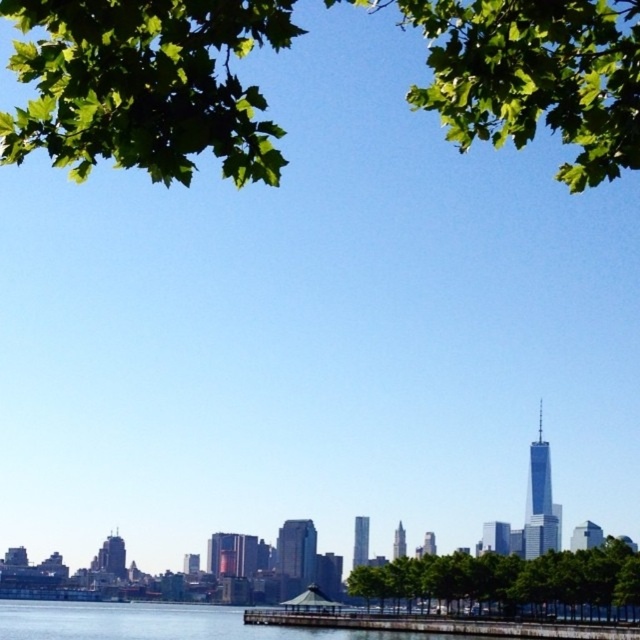
You are an architect designing a new garden and want to place two green leafy trees in your design. You have the green leafy tree at upper center and the green leafy tree at center. Which tree should you choose if you want a larger tree for a more dominant feature?

The green leafy tree at upper center should be chosen because it has a larger size compared to the green leafy tree at center, making it a better option for a dominant feature.

You are standing at the point marked by the coordinate point at point (106, 154) and want to reach the city skyline across the water. If your walking speed is 1.5 meters per second, how long will it take you to reach the skyline?

The distance between the point marked by the coordinate point at point (106, 154) and the city skyline is 628.17 meters. At a walking speed of 1.5 meters per second, it would take approximately 418.78 seconds to reach the skyline.

In the scene shown: You are a bird looking for a place to perch. You see two green leafy trees in the image. Which tree, the green leafy tree at upper center or the green leafy tree at center, has a wider canopy for you to land on?

The green leafy tree at upper center might be wider than green leafy tree at center, so it has a wider canopy for you to land on.